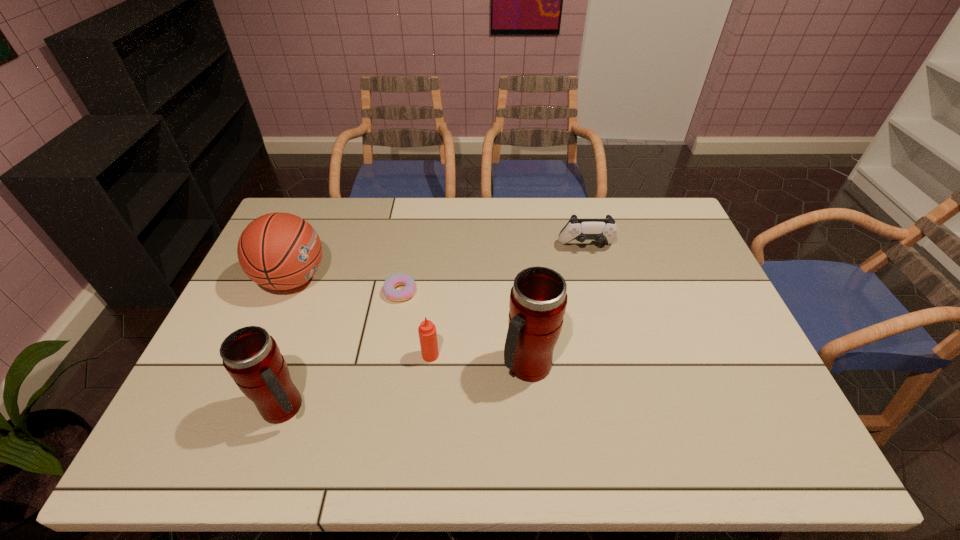
The image size is (960, 540). I want to click on the left thermos bottle, so click(251, 356).

This screenshot has width=960, height=540. Identify the location of the tallest object. (538, 299).

The width and height of the screenshot is (960, 540). I want to click on the right thermos bottle, so click(538, 299).

Where is `the fourth object from left to right`? This screenshot has width=960, height=540. the fourth object from left to right is located at coordinates pyautogui.click(x=427, y=332).

This screenshot has width=960, height=540. I want to click on the fourth tallest object, so click(x=427, y=332).

Locate an element on the screen. the rightmost object is located at coordinates (605, 229).

Locate an element on the screen. Image resolution: width=960 pixels, height=540 pixels. the second shortest object is located at coordinates (605, 229).

This screenshot has width=960, height=540. What are the coordinates of `doughnut` in the screenshot? It's located at coord(394,280).

Find the location of a particular element. the third object from left to right is located at coordinates (394, 280).

Locate an element on the screen. basketball is located at coordinates (280, 251).